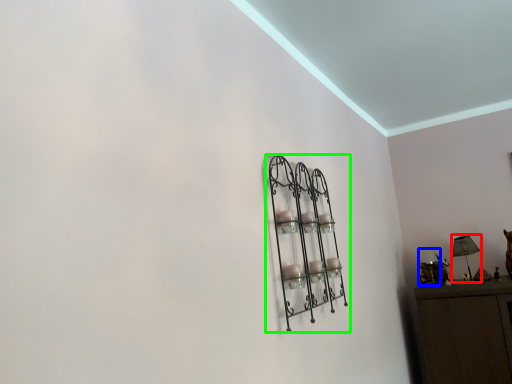
Question: Which object is the closest to the table lamp (highlighted by a red box)? Choose among these: lamp (highlighted by a blue box) or shelf (highlighted by a green box).

Choices:
 (A) lamp
 (B) shelf

Answer: (A)